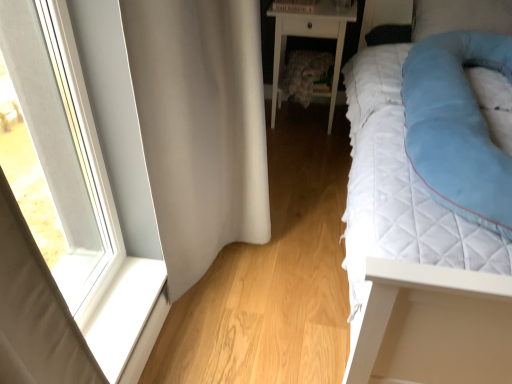
The image size is (512, 384). I want to click on empty space that is in between white glossy nightstand at center and white fabric curtain at left, so click(296, 173).